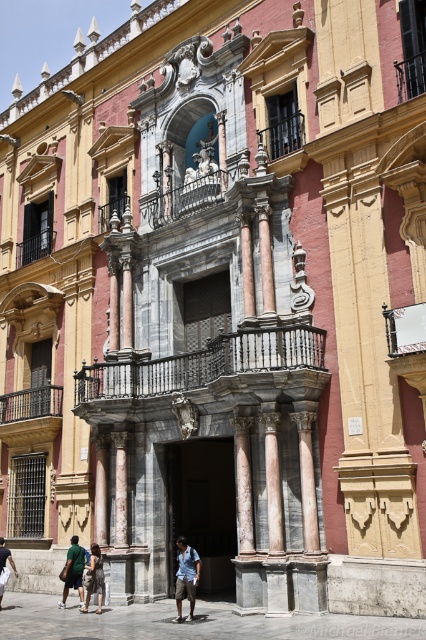
You are an interior designer assessing the space in front of the marble column at center and the light blue denim shorts at lower center. Which object takes up more physical space in the scene?

The light blue denim shorts at lower center occupies more space than the marble column at center according to the description.

You are a tourist standing in front of the grand building and see the marble column at center and the light blue denim shorts at lower center. Which object is located to the right of the other?

The marble column at center is positioned on the right side of light blue denim shorts at lower center.

You are a visitor standing at the entrance of the grand building and notice the marble column at center and the green cotton shorts at lower left. From your perspective, which object is positioned higher?

The marble column at center is located above the green cotton shorts at lower left, so it is positioned higher from your perspective.